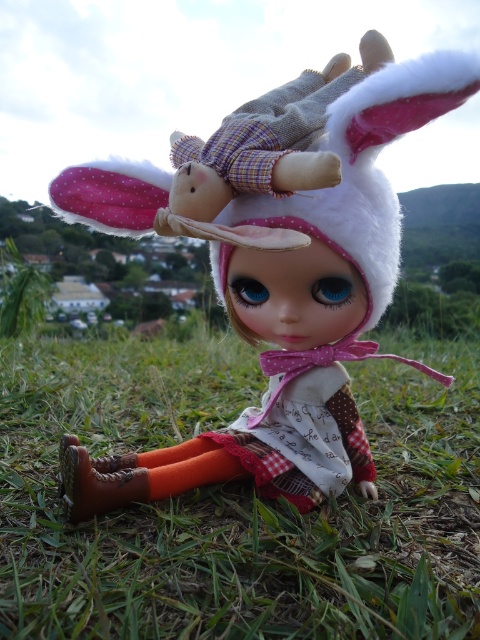
Question: Where is green grass at center located in relation to matte fabric doll at center in the image?

Choices:
 (A) above
 (B) below

Answer: (B)

Question: Does green grass at center have a smaller size compared to matte fabric doll at center?

Choices:
 (A) no
 (B) yes

Answer: (A)

Question: Among these points, which one is nearest to the camera?

Choices:
 (A) (144, 195)
 (B) (13, 548)

Answer: (B)

Question: Observing the image, what is the correct spatial positioning of green grass at center in reference to matte fabric doll at center?

Choices:
 (A) right
 (B) left

Answer: (B)

Question: Among these points, which one is farthest from the camera?

Choices:
 (A) pyautogui.click(x=12, y=440)
 (B) pyautogui.click(x=328, y=474)

Answer: (A)